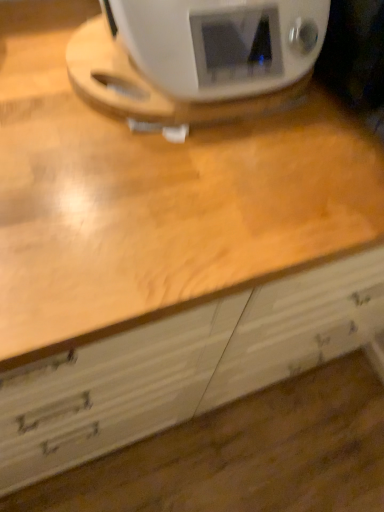
Locate an element on the screen. The width and height of the screenshot is (384, 512). free space in front of white plastic toaster at upper center is located at coordinates (158, 195).